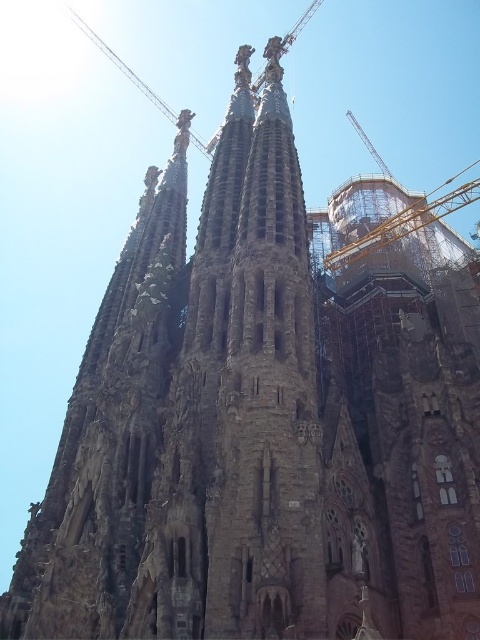
This screenshot has height=640, width=480. In order to click on metallic scaffolding at right in this screenshot , I will do `click(407, 221)`.

Based on the photo, who is lower down, metallic scaffolding at right or metallic construction crane at upper center?

metallic scaffolding at right

I want to click on metallic scaffolding at right, so click(407, 221).

At what (x,y) coordinates should I click in order to perform the action: click on metallic scaffolding at right. Please return your answer as a coordinate pair (x, y). This screenshot has height=640, width=480. Looking at the image, I should click on (407, 221).